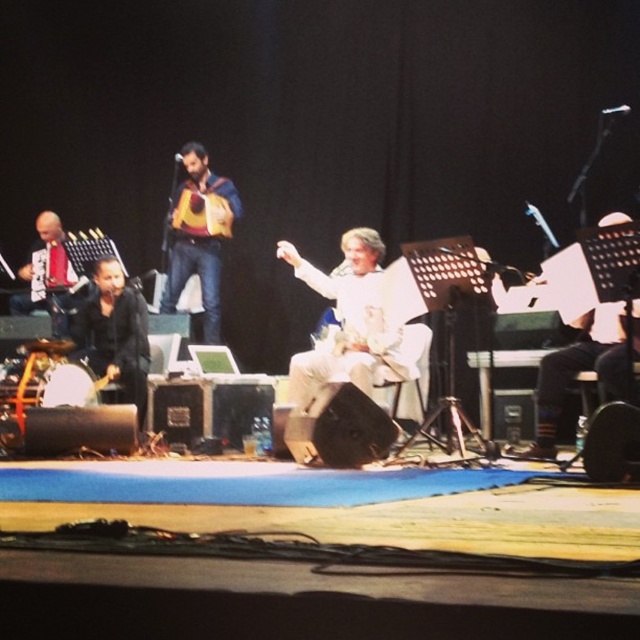
You are a stagehand preparing to place a new microphone stand between the white fabric at center and the matte black guitar at left. Given their sizes, which object will require more space horizontally to accommodate the stand?

The white fabric at center has a larger width than the matte black guitar at left, so placing the microphone stand between them would require more space for the white fabric at center to accommodate the stand.

You are a stagehand who needs to adjust the lighting for the performer. The spotlight should focus on the white fabric at center and the matte black guitar at left. Since the guitar is positioned to the left of the fabric, which object should you adjust first to ensure proper alignment?

The matte black guitar at left should be adjusted first because it is positioned to the left of the white fabric at center, so aligning it properly will help ensure the spotlight covers both objects correctly.

Based on the photo, you are a stagehand who needs to place a microphone stand exactly at the point marked as point (198, 236). According to the scene description, where should you position the microphone stand?

The point (198, 236) is on the brown leather guitar at center, so you should place the microphone stand on the brown leather guitar at center.